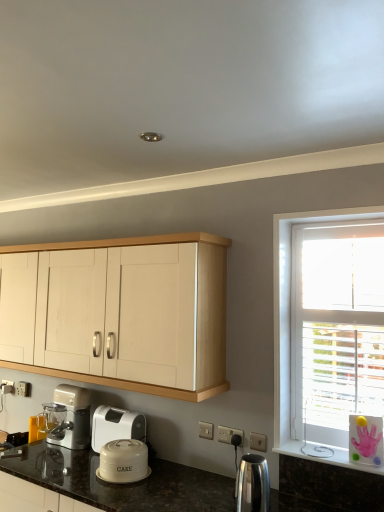
Question: From the image's perspective, does matte white cake container at lower center, acting as the 1th kitchen appliance starting from the back, appear lower than polished stainless steel kettle at lower center, acting as the 2th kitchen appliance starting from the back?

Choices:
 (A) no
 (B) yes

Answer: (B)

Question: Does matte white cake container at lower center, arranged as the 2th kitchen appliance when viewed from the right, have a larger size compared to polished stainless steel kettle at lower center, the first kitchen appliance in the front-to-back sequence?

Choices:
 (A) no
 (B) yes

Answer: (B)

Question: Could you tell me if matte white cake container at lower center, the 1th kitchen appliance positioned from the left, is facing polished stainless steel kettle at lower center, which appears as the second kitchen appliance when viewed from the left?

Choices:
 (A) yes
 (B) no

Answer: (B)

Question: Considering the relative sizes of matte white cake container at lower center, acting as the 1th kitchen appliance starting from the back, and polished stainless steel kettle at lower center, which appears as the second kitchen appliance when viewed from the left, in the image provided, is matte white cake container at lower center, acting as the 1th kitchen appliance starting from the back, thinner than polished stainless steel kettle at lower center, which appears as the second kitchen appliance when viewed from the left,?

Choices:
 (A) yes
 (B) no

Answer: (B)

Question: Considering the relative positions of matte white cake container at lower center, the 1th kitchen appliance positioned from the left, and polished stainless steel kettle at lower center, acting as the 1th kitchen appliance starting from the right, in the image provided, is matte white cake container at lower center, the 1th kitchen appliance positioned from the left, to the right of polished stainless steel kettle at lower center, acting as the 1th kitchen appliance starting from the right, from the viewer's perspective?

Choices:
 (A) no
 (B) yes

Answer: (A)

Question: Is point (112, 430) closer or farther from the camera than point (77, 391)?

Choices:
 (A) closer
 (B) farther

Answer: (A)

Question: Looking at the image, does white plastic container at lower center, marked as the 2th home appliance in a left-to-right arrangement, seem bigger or smaller compared to matte silver blender at lower left, which is counted as the 1th home appliance, starting from the left?

Choices:
 (A) small
 (B) big

Answer: (A)

Question: Is white plastic container at lower center, arranged as the 1th home appliance when viewed from the right, in front of or behind matte silver blender at lower left, positioned as the 2th home appliance in right-to-left order, in the image?

Choices:
 (A) front
 (B) behind

Answer: (A)

Question: From their relative heights in the image, would you say white plastic container at lower center, marked as the 2th home appliance in a left-to-right arrangement, is taller or shorter than matte silver blender at lower left, positioned as the 2th home appliance in right-to-left order?

Choices:
 (A) short
 (B) tall

Answer: (A)

Question: Relative to white plastic container at lower center, marked as the 2th home appliance in a left-to-right arrangement, is light wood cabinet at upper center in front or behind?

Choices:
 (A) behind
 (B) front

Answer: (B)

Question: From the image's perspective, is light wood cabinet at upper center located above or below white plastic container at lower center, arranged as the 1th home appliance when viewed from the right?

Choices:
 (A) below
 (B) above

Answer: (B)

Question: Is light wood cabinet at upper center taller or shorter than white plastic container at lower center, marked as the 2th home appliance in a left-to-right arrangement?

Choices:
 (A) short
 (B) tall

Answer: (B)

Question: Looking at the image, does light wood cabinet at upper center seem bigger or smaller compared to white plastic container at lower center, arranged as the 1th home appliance when viewed from the right?

Choices:
 (A) small
 (B) big

Answer: (B)

Question: From the image's perspective, is polished stainless steel kettle at lower center, acting as the 1th kitchen appliance starting from the right, above or below light wood cabinet at upper center?

Choices:
 (A) above
 (B) below

Answer: (B)

Question: Visually, is polished stainless steel kettle at lower center, acting as the 2th kitchen appliance starting from the back, positioned to the left or to the right of light wood cabinet at upper center?

Choices:
 (A) left
 (B) right

Answer: (B)